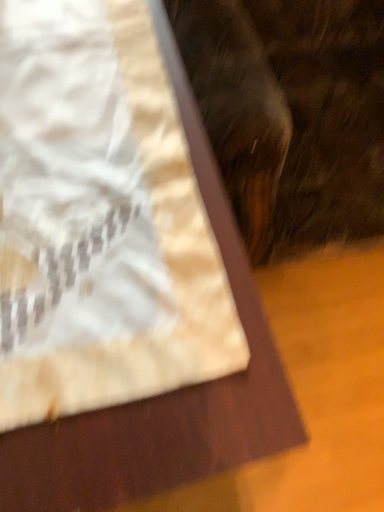
This screenshot has height=512, width=384. What do you see at coordinates (100, 220) in the screenshot?
I see `white paper bag at center` at bounding box center [100, 220].

The height and width of the screenshot is (512, 384). Find the location of `white paper bag at center`. white paper bag at center is located at coordinates (100, 220).

Image resolution: width=384 pixels, height=512 pixels. I want to click on fuzzy brown cat at upper right, so click(x=291, y=114).

This screenshot has height=512, width=384. Describe the element at coordinates (291, 114) in the screenshot. I see `fuzzy brown cat at upper right` at that location.

Where is `white paper bag at center`? white paper bag at center is located at coordinates (100, 220).

Can you confirm if white paper bag at center is positioned to the left of fuzzy brown cat at upper right?

Yes, white paper bag at center is to the left of fuzzy brown cat at upper right.

Considering the positions of objects white paper bag at center and fuzzy brown cat at upper right in the image provided, who is in front, white paper bag at center or fuzzy brown cat at upper right?

fuzzy brown cat at upper right.

Which is further, [80,16] or [247,178]?

Positioned behind is point [247,178].

From the image's perspective, is white paper bag at center under fuzzy brown cat at upper right?

Indeed, from the image's perspective, white paper bag at center is shown beneath fuzzy brown cat at upper right.

From a real-world perspective, between white paper bag at center and fuzzy brown cat at upper right, who is vertically higher?

In real-world perspective, fuzzy brown cat at upper right is above.

Which object is wider, white paper bag at center or fuzzy brown cat at upper right?

Wider between the two is white paper bag at center.

Which of these two, white paper bag at center or fuzzy brown cat at upper right, stands shorter?

white paper bag at center.

Which of these two, white paper bag at center or fuzzy brown cat at upper right, is smaller?

Smaller between the two is white paper bag at center.

Is white paper bag at center not within fuzzy brown cat at upper right?

Yes, white paper bag at center is located beyond the bounds of fuzzy brown cat at upper right.

In the scene shown: Can you see white paper bag at center touching fuzzy brown cat at upper right?

No, white paper bag at center is not beside fuzzy brown cat at upper right.

Is white paper bag at center turned away from fuzzy brown cat at upper right?

No, white paper bag at center is not facing away from fuzzy brown cat at upper right.

Measure the distance from white paper bag at center to fuzzy brown cat at upper right.

white paper bag at center and fuzzy brown cat at upper right are 15.43 inches apart from each other.

At what (x,y) coordinates should I click in order to perform the action: click on animal on the right of white paper bag at center. Please return your answer as a coordinate pair (x, y). Looking at the image, I should click on (291, 114).

Can you confirm if fuzzy brown cat at upper right is positioned to the left of white paper bag at center?

No, fuzzy brown cat at upper right is not to the left of white paper bag at center.

Is fuzzy brown cat at upper right closer to the viewer compared to white paper bag at center?

Yes, fuzzy brown cat at upper right is closer to the camera.

Which point is more distant from viewer, [348,198] or [149,204]?

The point [348,198] is behind.

From the image's perspective, would you say fuzzy brown cat at upper right is shown under white paper bag at center?

Actually, fuzzy brown cat at upper right appears above white paper bag at center in the image.

In the scene shown: From a real-world perspective, does fuzzy brown cat at upper right sit lower than white paper bag at center?

Actually, fuzzy brown cat at upper right is physically above white paper bag at center in the real world.

Considering the sizes of objects fuzzy brown cat at upper right and white paper bag at center in the image provided, who is thinner, fuzzy brown cat at upper right or white paper bag at center?

fuzzy brown cat at upper right is thinner.

Looking at this image, considering the relative sizes of fuzzy brown cat at upper right and white paper bag at center in the image provided, is fuzzy brown cat at upper right taller than white paper bag at center?

Correct, fuzzy brown cat at upper right is much taller as white paper bag at center.

Can you confirm if fuzzy brown cat at upper right is smaller than white paper bag at center?

No.

From the picture: Would you say white paper bag at center is part of fuzzy brown cat at upper right's contents?

That's incorrect, white paper bag at center is not inside fuzzy brown cat at upper right.

Is fuzzy brown cat at upper right next to white paper bag at center and touching it?

fuzzy brown cat at upper right and white paper bag at center are clearly separated.

Is fuzzy brown cat at upper right oriented away from white paper bag at center?

No, white paper bag at center is not at the back of fuzzy brown cat at upper right.

Find the location of `sheet directly beneath the fuzzy brown cat at upper right (from a real-world perspective)`. sheet directly beneath the fuzzy brown cat at upper right (from a real-world perspective) is located at coordinates (100, 220).

What are the coordinates of `animal in front of the white paper bag at center` in the screenshot? It's located at (291, 114).

Find the location of a particular element. This screenshot has width=384, height=512. sheet beneath the fuzzy brown cat at upper right (from a real-world perspective) is located at coordinates (100, 220).